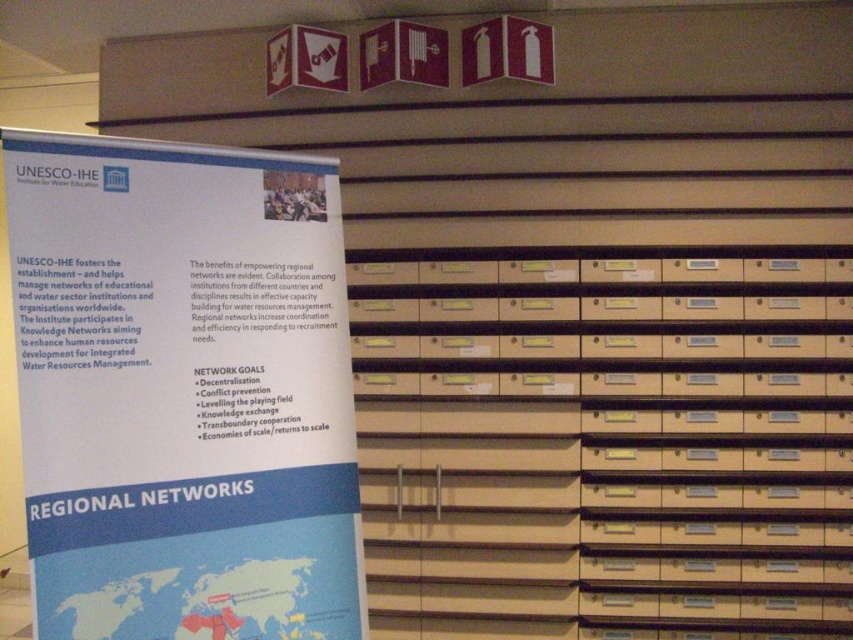
Question: Considering the relative positions of beige cardboard drawers at center and white paper poster at left in the image provided, where is beige cardboard drawers at center located with respect to white paper poster at left?

Choices:
 (A) right
 (B) left

Answer: (A)

Question: Does beige cardboard drawers at center come in front of white paper poster at left?

Choices:
 (A) no
 (B) yes

Answer: (A)

Question: Which point is farther to the camera?

Choices:
 (A) tap(44, 364)
 (B) tap(763, 486)

Answer: (B)

Question: Is beige cardboard drawers at center to the right of white paper poster at left from the viewer's perspective?

Choices:
 (A) no
 (B) yes

Answer: (B)